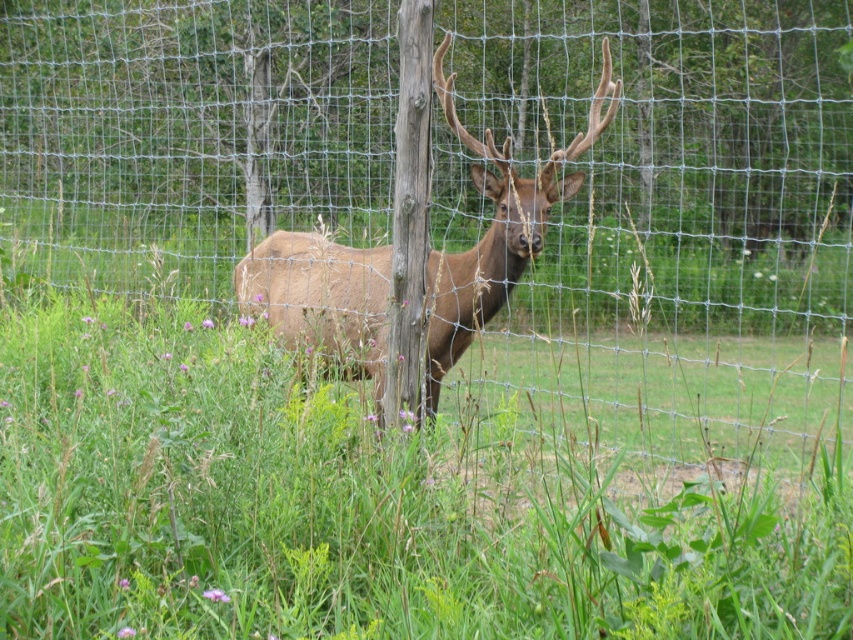
Which is in front, point (241, 179) or point (329, 317)?

Positioned in front is point (329, 317).

Can you confirm if wire mesh fence at center is wider than brown velvet deer at center?

Correct, the width of wire mesh fence at center exceeds that of brown velvet deer at center.

Locate an element on the screen. Image resolution: width=853 pixels, height=640 pixels. wire mesh fence at center is located at coordinates (677, 150).

Does point (192, 156) come farther from viewer compared to point (260, 397)?

Yes.

Between wire mesh fence at center and green grassy at center, which one has less height?

Standing shorter between the two is green grassy at center.

Is point (234, 204) farther from viewer compared to point (166, 429)?

Yes.

Image resolution: width=853 pixels, height=640 pixels. In order to click on wire mesh fence at center in this screenshot , I will do `click(677, 150)`.

Is green grassy at center to the left of brown velvet deer at center from the viewer's perspective?

Yes, green grassy at center is to the left of brown velvet deer at center.

Is green grassy at center taller than brown velvet deer at center?

Incorrect, green grassy at center's height is not larger of brown velvet deer at center's.

Between point (235, 481) and point (258, 253), which one is positioned in front?

Point (235, 481) is in front.

The width and height of the screenshot is (853, 640). I want to click on green grassy at center, so click(x=363, y=504).